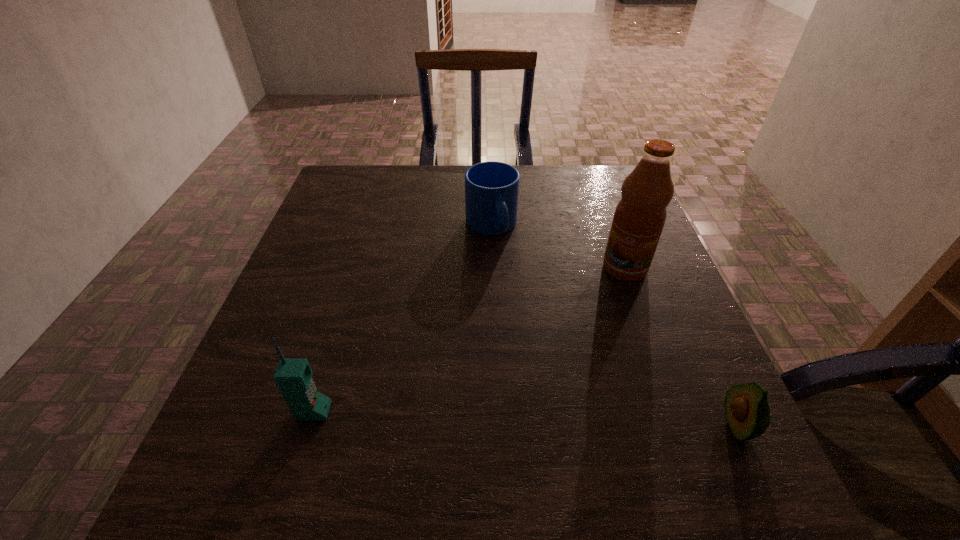
You are a GUI agent. You are given a task and a screenshot of the screen. Output one action in this format:
    pyautogui.click(x=<x>, y=<y>)
    Task: Click on the free point between the second object from right to left and the third object from right to left
    
    Given the screenshot: What is the action you would take?
    pyautogui.click(x=558, y=247)

The width and height of the screenshot is (960, 540). Identify the location of empty space that is in between the avocado and the third object from left to right. [682, 347].

The image size is (960, 540). I want to click on unoccupied area between the cellular telephone and the second object from left to right, so 402,319.

Where is `free space between the avocado and the mug`? This screenshot has width=960, height=540. free space between the avocado and the mug is located at coordinates (614, 326).

The width and height of the screenshot is (960, 540). I want to click on free space between the leftmost object and the mug, so click(402, 319).

You are a GUI agent. You are given a task and a screenshot of the screen. Output one action in this format:
    pyautogui.click(x=<x>, y=<y>)
    Task: Click on the vacant space that is in between the mug and the cellular telephone
    The image size is (960, 540).
    Given the screenshot: What is the action you would take?
    pyautogui.click(x=402, y=319)

This screenshot has height=540, width=960. I want to click on vacant point located between the fruit juice and the avocado, so click(682, 347).

Find the location of a particular element. free space between the farthest object and the tallest object is located at coordinates (558, 247).

Image resolution: width=960 pixels, height=540 pixels. I want to click on unoccupied area between the third nearest object and the rightmost object, so click(x=682, y=347).

Where is `free space that is in between the leftmost object and the rightmost object`? free space that is in between the leftmost object and the rightmost object is located at coordinates (526, 418).